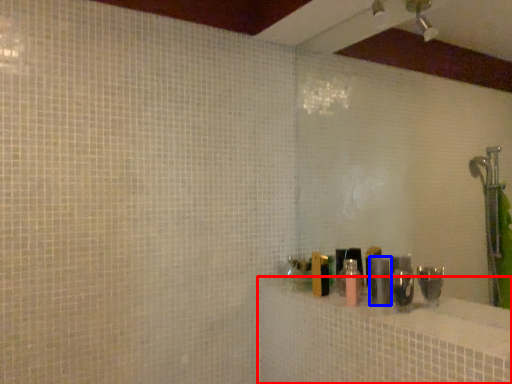
Question: Which object is closer to the camera taking this photo, bath (highlighted by a red box) or toiletry (highlighted by a blue box)?

Choices:
 (A) bath
 (B) toiletry

Answer: (A)